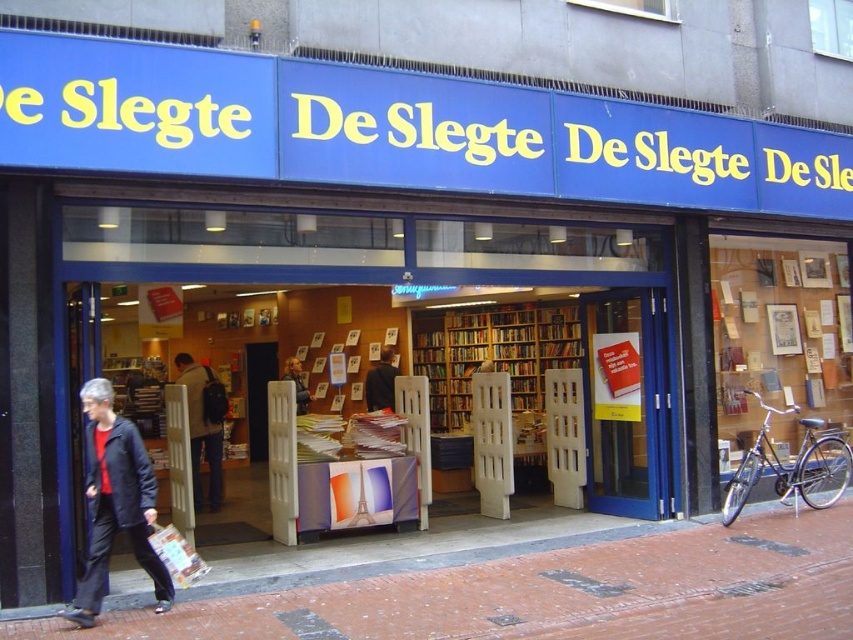
You are a delivery person standing at the entrance of the bookstore. You need to place a package that is 1.5 meters long between the dark gray backpack at center and the smooth black jacket at center. Is there enough space between them to fit the package?

The dark gray backpack at center is 1.49 meters from the smooth black jacket at center. Since the package is 1.5 meters long, it cannot fit between them as the distance is slightly shorter than the package length.

You are a customer entering the bookstore and see the wooden bookshelf at center and the dark brown leather jacket at center. Which object takes up more space in the store?

The wooden bookshelf at center is bigger than the dark brown leather jacket at center, so it takes up more space in the store.